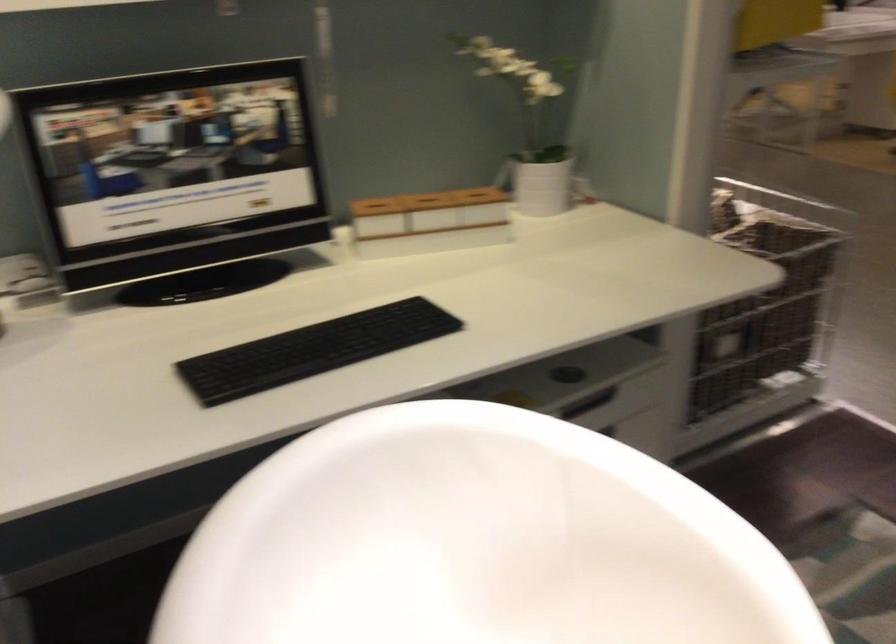
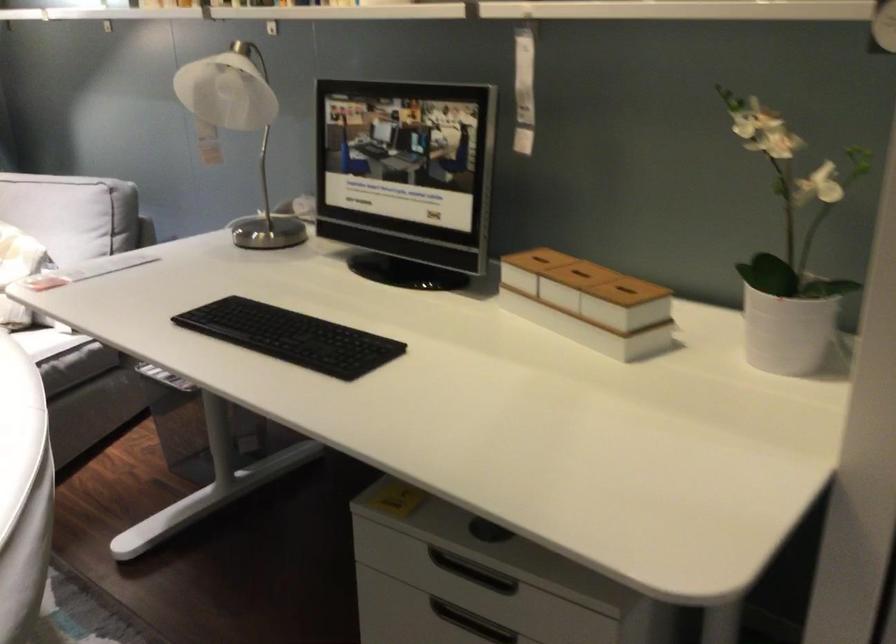
Locate, in the second image, the point that corresponds to pixel 355 342 in the first image.

(291, 337)